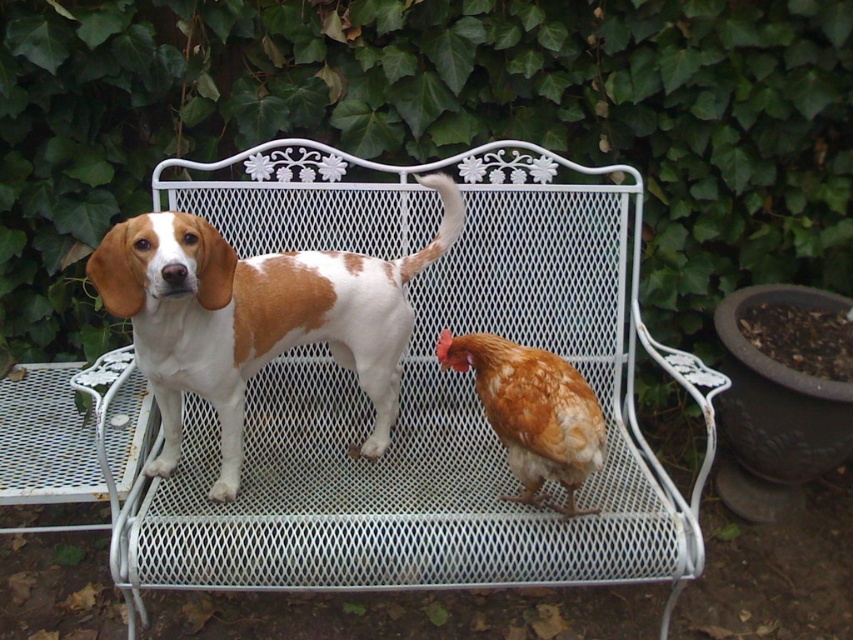
Can you confirm if white metal bench at center is taller than brown and white fur dog at center?

Yes.

Does point (534, 312) come farther from viewer compared to point (173, 444)?

Yes, point (534, 312) is behind point (173, 444).

Locate an element on the screen. white metal bench at center is located at coordinates (422, 392).

Is brown and white fur dog at center taller than brown feathered chicken at center?

Yes.

What do you see at coordinates (256, 317) in the screenshot? I see `brown and white fur dog at center` at bounding box center [256, 317].

Looking at this image, who is more forward, (254, 344) or (538, 422)?

Point (538, 422) is more forward.

This screenshot has height=640, width=853. I want to click on brown and white fur dog at center, so click(256, 317).

Who is positioned more to the left, white metal bench at center or brown feathered chicken at center?

white metal bench at center

Is white metal bench at center positioned behind brown feathered chicken at center?

That is True.

Between point (372, 193) and point (573, 388), which one is positioned behind?

The point (372, 193) is behind.

This screenshot has height=640, width=853. Identify the location of white metal bench at center. (422, 392).